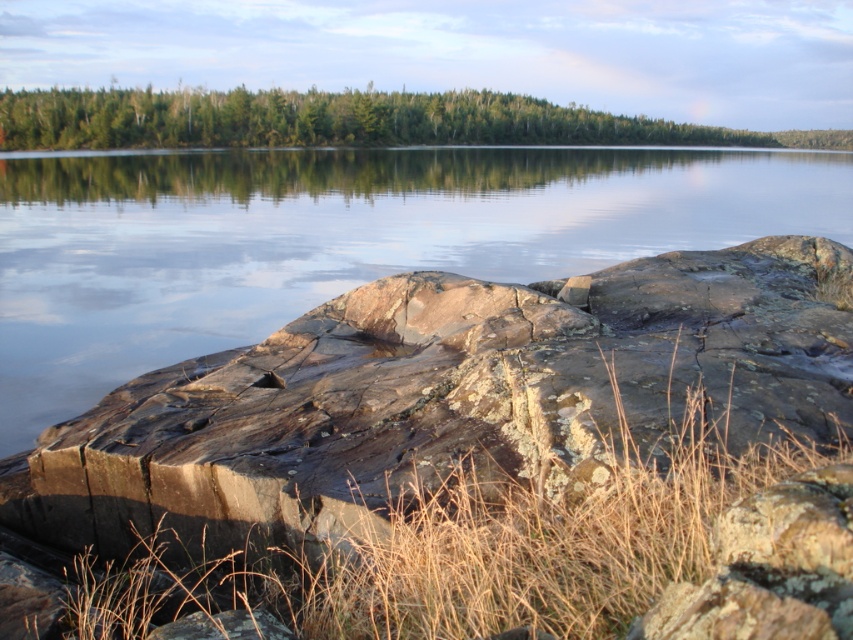
You are standing at the edge of the water in the serene landscape. There is a point marked at coordinates point (573, 170). Can you reach this point without getting wet?

The point (573, 170) is 82.19 meters away from you, so you can reach it without getting wet since it is a considerable distance from the water edge.

You are standing on the rocky outcrop in the foreground of the scene. Looking towards the center, you see the clear water at center and the green matte forest at upper center. Which object is located higher up in the image?

The green matte forest at upper center is located higher up in the image than the clear water at center.

You are standing on the rocky outcrop and want to look towards the clear water at center. Which direction should you face relative to the green matte forest at upper center?

You should face to the left of the green matte forest at upper center because the clear water at center is located to the left of it.